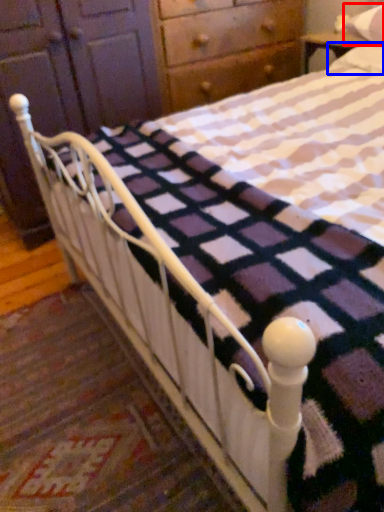
Question: Which point is closer to the camera, pillow (highlighted by a red box) or pillow (highlighted by a blue box)?

Choices:
 (A) pillow
 (B) pillow

Answer: (B)